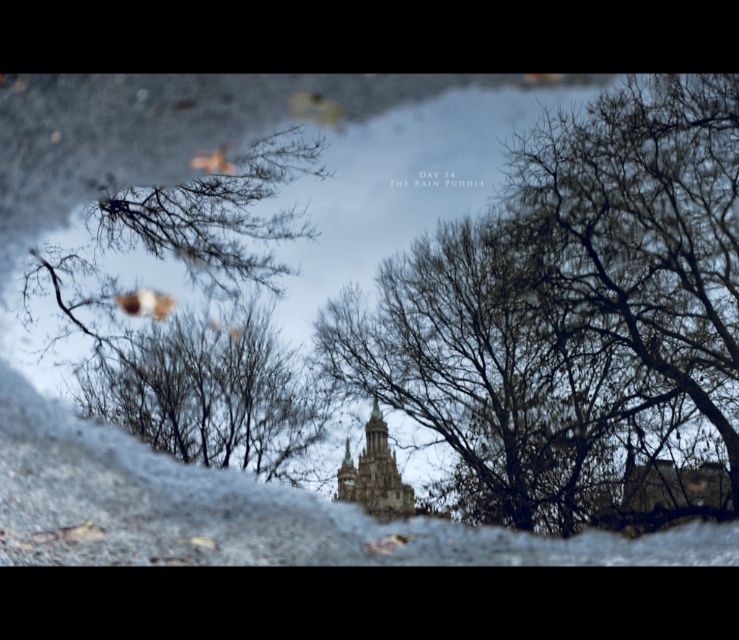
Question: Can you confirm if brown matte tree at center is positioned above golden stone bell tower at center?

Choices:
 (A) yes
 (B) no

Answer: (A)

Question: Where is brown matte tree at center located in relation to golden stone bell tower at center in the image?

Choices:
 (A) above
 (B) below

Answer: (A)

Question: Does brown matte tree at center appear under golden stone bell tower at center?

Choices:
 (A) no
 (B) yes

Answer: (A)

Question: Which point is closer to the camera taking this photo?

Choices:
 (A) (391, 500)
 (B) (282, 378)

Answer: (A)

Question: Which of the following is the closest to the observer?

Choices:
 (A) (180, 349)
 (B) (350, 464)

Answer: (B)